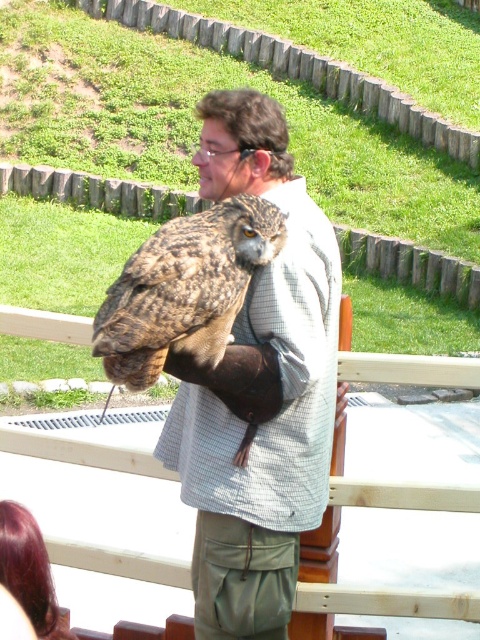
Is the position of matte brown owl at upper center more distant than that of brown feathered owl at center?

Yes, it is behind brown feathered owl at center.

What do you see at coordinates (257, 388) in the screenshot? I see `matte brown owl at upper center` at bounding box center [257, 388].

Which is in front, point (244, 145) or point (113, 296)?

Point (113, 296) is in front.

The width and height of the screenshot is (480, 640). I want to click on matte brown owl at upper center, so click(257, 388).